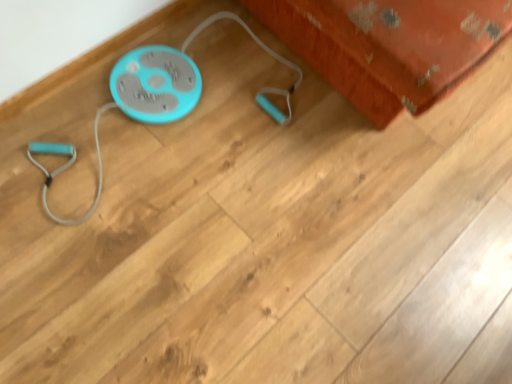
Describe the element at coordinates (389, 46) in the screenshot. This screenshot has height=384, width=512. I see `velvet orange ottoman at lower right` at that location.

The width and height of the screenshot is (512, 384). Find the location of `velvet orange ottoman at lower right`. velvet orange ottoman at lower right is located at coordinates tap(389, 46).

Identify the location of velvet orange ottoman at lower right. (389, 46).